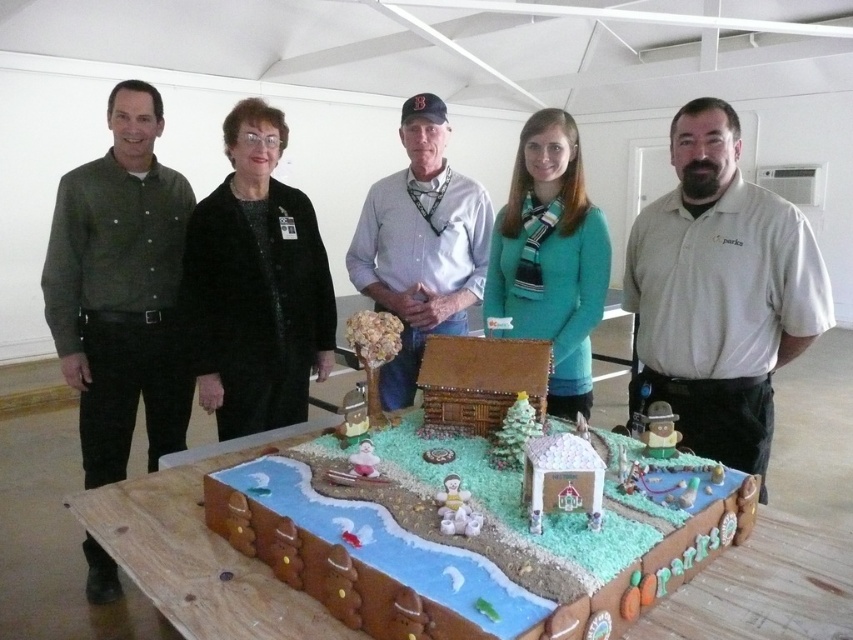
Question: Which point appears farthest from the camera in this image?

Choices:
 (A) (759, 296)
 (B) (428, 104)
 (C) (485, 314)
 (D) (775, 541)

Answer: (B)

Question: Does green cotton shirt at left appear over white shirt at center?

Choices:
 (A) no
 (B) yes

Answer: (A)

Question: Does brown sugar-coated gingerbread house at center have a larger size compared to green cotton shirt at left?

Choices:
 (A) yes
 (B) no

Answer: (B)

Question: Which object appears farthest from the camera in this image?

Choices:
 (A) black fuzzy coat at center
 (B) teal matte sweater at center

Answer: (A)

Question: Is brown sugar-coated gingerbread house at center to the left of teal matte sweater at center from the viewer's perspective?

Choices:
 (A) yes
 (B) no

Answer: (A)

Question: Which object appears farthest from the camera in this image?

Choices:
 (A) black fuzzy coat at center
 (B) brown sugar-coated gingerbread house at center
 (C) gray cotton shirt at center

Answer: (A)